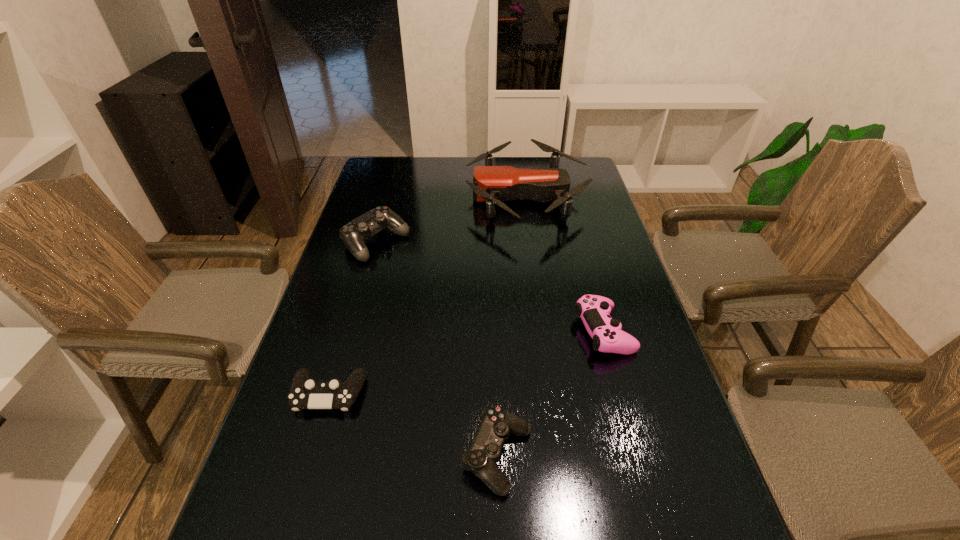
Identify the location of drone. This screenshot has width=960, height=540. (492, 184).

Locate an element on the screen. This screenshot has height=540, width=960. the farthest control is located at coordinates (353, 234).

The height and width of the screenshot is (540, 960). I want to click on the fourth shortest object, so click(x=353, y=234).

The height and width of the screenshot is (540, 960). What are the coordinates of `the third nearest control` in the screenshot? It's located at 594,310.

Where is `the third nearest object`? the third nearest object is located at coordinates (594, 310).

Locate an element on the screen. Image resolution: width=960 pixels, height=540 pixels. the nearest object is located at coordinates (484, 452).

Locate an element on the screen. The image size is (960, 540). the second control from right to left is located at coordinates (484, 452).

Where is `the shortest control`? The height and width of the screenshot is (540, 960). the shortest control is located at coordinates point(305,393).

You are a GUI agent. You are given a task and a screenshot of the screen. Output one action in this format:
    pyautogui.click(x=<x>, y=<y>)
    Task: Click on the shortest object
    
    Given the screenshot: What is the action you would take?
    pyautogui.click(x=305, y=393)

The image size is (960, 540). What are the coordinates of `vacant space located on the front-facing side of the tallest object` in the screenshot? It's located at (366, 197).